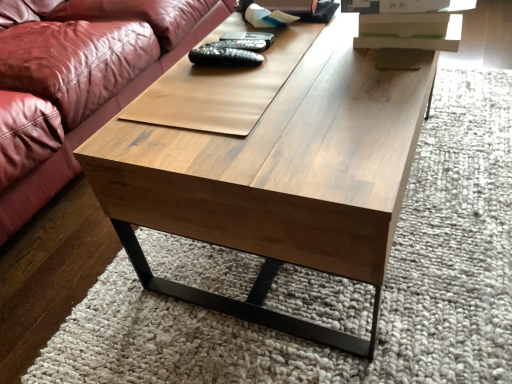
What do you see at coordinates (240, 44) in the screenshot? I see `black matte remote at center, positioned as the second remote in bottom-to-top order` at bounding box center [240, 44].

Identify the location of black matte remote at center, the 3th remote when ordered from top to bottom. (224, 56).

What is the approximate height of wooden coffee table at center?

The height of wooden coffee table at center is 44.44 centimeters.

Find the location of a particular element. This screenshot has width=512, height=384. black matte remote at center, which ranks as the second remote in top-to-bottom order is located at coordinates coord(240,44).

Based on the photo, how different are the orientations of wooden coffee table at center and black matte remote at center, which ranks as the second remote in top-to-bottom order, in degrees?

The facing directions of wooden coffee table at center and black matte remote at center, which ranks as the second remote in top-to-bottom order, are 4.7 degrees apart.

Who is shorter, wooden coffee table at center or black matte remote at center, which ranks as the second remote in top-to-bottom order?

Standing shorter between the two is black matte remote at center, which ranks as the second remote in top-to-bottom order.

Based on their sizes in the image, would you say wooden coffee table at center is bigger or smaller than black matte remote at center, positioned as the second remote in bottom-to-top order?

Clearly, wooden coffee table at center is larger in size than black matte remote at center, positioned as the second remote in bottom-to-top order.

Is black matte remote at center, positioned as the second remote in bottom-to-top order, aimed at wooden coffee table at center?

No, black matte remote at center, positioned as the second remote in bottom-to-top order, is not turned towards wooden coffee table at center.

Is black matte remote at center, positioned as the second remote in bottom-to-top order, thinner than wooden coffee table at center?

Correct, the width of black matte remote at center, positioned as the second remote in bottom-to-top order, is less than that of wooden coffee table at center.

From the image's perspective, is black matte remote at center, which ranks as the second remote in top-to-bottom order, located above wooden coffee table at center?

Indeed, from the image's perspective, black matte remote at center, which ranks as the second remote in top-to-bottom order, is shown above wooden coffee table at center.

How distant is black matte remote at center, positioned as the second remote in bottom-to-top order, from wooden coffee table at center?

A distance of 16.55 inches exists between black matte remote at center, positioned as the second remote in bottom-to-top order, and wooden coffee table at center.

Which point is more forward, (250, 47) or (259, 38)?

Point (250, 47)

From a real-world perspective, who is located higher, black matte remote at center, positioned as the second remote in bottom-to-top order, or black plastic remote at center, the 3th remote ordered from the bottom?

From a 3D spatial view, black plastic remote at center, the 3th remote ordered from the bottom, is above.

Which object is positioned more to the left, black matte remote at center, which ranks as the second remote in top-to-bottom order, or black plastic remote at center, which ranks as the first remote in top-to-bottom order?

black matte remote at center, which ranks as the second remote in top-to-bottom order.

Which object is thinner, wooden coffee table at center or black plastic remote at center, which ranks as the first remote in top-to-bottom order?

black plastic remote at center, which ranks as the first remote in top-to-bottom order, is thinner.

Considering the sizes of wooden coffee table at center and black plastic remote at center, the 3th remote ordered from the bottom, in the image, is wooden coffee table at center bigger or smaller than black plastic remote at center, the 3th remote ordered from the bottom,?

In the image, wooden coffee table at center appears to be larger than black plastic remote at center, the 3th remote ordered from the bottom.

In the scene shown: Would you say wooden coffee table at center is outside black plastic remote at center, which ranks as the first remote in top-to-bottom order?

Absolutely, wooden coffee table at center is external to black plastic remote at center, which ranks as the first remote in top-to-bottom order.

Can you confirm if black plastic remote at center, the 3th remote ordered from the bottom, is smaller than black matte remote at center, the 3th remote when ordered from top to bottom?

Indeed, black plastic remote at center, the 3th remote ordered from the bottom, has a smaller size compared to black matte remote at center, the 3th remote when ordered from top to bottom.

From the image's perspective, is black plastic remote at center, the 3th remote ordered from the bottom, above or below black matte remote at center, positioned as the first remote in bottom-to-top order?

Clearly, from the image's perspective, black plastic remote at center, the 3th remote ordered from the bottom, is above black matte remote at center, positioned as the first remote in bottom-to-top order.

From a real-world perspective, is black plastic remote at center, which ranks as the first remote in top-to-bottom order, on top of black matte remote at center, the 3th remote when ordered from top to bottom?

No, from a real-world perspective, black plastic remote at center, which ranks as the first remote in top-to-bottom order, is not above black matte remote at center, the 3th remote when ordered from top to bottom.

Looking at their sizes, would you say black plastic remote at center, the 3th remote ordered from the bottom, is wider or thinner than black matte remote at center, positioned as the first remote in bottom-to-top order?

black plastic remote at center, the 3th remote ordered from the bottom, is thinner than black matte remote at center, positioned as the first remote in bottom-to-top order.

Is black plastic remote at center, the 3th remote ordered from the bottom, positioned with its back to wooden coffee table at center?

No.

Would you consider black plastic remote at center, which ranks as the first remote in top-to-bottom order, to be distant from wooden coffee table at center?

No, black plastic remote at center, which ranks as the first remote in top-to-bottom order, is in close proximity to wooden coffee table at center.

Between black plastic remote at center, the 3th remote ordered from the bottom, and wooden coffee table at center, which one appears on the left side from the viewer's perspective?

Positioned to the left is black plastic remote at center, the 3th remote ordered from the bottom.

Is black plastic remote at center, which ranks as the first remote in top-to-bottom order, wider than wooden coffee table at center?

No.

Between black plastic remote at center, which ranks as the first remote in top-to-bottom order, and black matte remote at center, which ranks as the second remote in top-to-bottom order, which one appears on the right side from the viewer's perspective?

Positioned to the right is black plastic remote at center, which ranks as the first remote in top-to-bottom order.

What's the angular difference between black plastic remote at center, which ranks as the first remote in top-to-bottom order, and black matte remote at center, positioned as the second remote in bottom-to-top order,'s facing directions?

0.00109 degrees separate the facing orientations of black plastic remote at center, which ranks as the first remote in top-to-bottom order, and black matte remote at center, positioned as the second remote in bottom-to-top order.

Which object is further away from the camera taking this photo, black plastic remote at center, which ranks as the first remote in top-to-bottom order, or black matte remote at center, which ranks as the second remote in top-to-bottom order?

black plastic remote at center, which ranks as the first remote in top-to-bottom order, is more distant.

Considering the sizes of objects black plastic remote at center, the 3th remote ordered from the bottom, and black matte remote at center, which ranks as the second remote in top-to-bottom order, in the image provided, who is taller, black plastic remote at center, the 3th remote ordered from the bottom, or black matte remote at center, which ranks as the second remote in top-to-bottom order,?

With more height is black plastic remote at center, the 3th remote ordered from the bottom.

In the image, there is a black matte remote at center, which ranks as the second remote in top-to-bottom order. Identify the location of coffee table below it (from a real-world perspective). This screenshot has width=512, height=384. (279, 177).

Locate an element on the screen. The width and height of the screenshot is (512, 384). coffee table in front of the black matte remote at center, which ranks as the second remote in top-to-bottom order is located at coordinates (x=279, y=177).

From the image, which object appears to be nearer to wooden coffee table at center, black matte remote at center, which ranks as the second remote in top-to-bottom order, or black plastic remote at center, which ranks as the first remote in top-to-bottom order?

The object closer to wooden coffee table at center is black matte remote at center, which ranks as the second remote in top-to-bottom order.

Looking at the image, which one is located further to black plastic remote at center, which ranks as the first remote in top-to-bottom order, black matte remote at center, positioned as the second remote in bottom-to-top order, or black matte remote at center, positioned as the first remote in bottom-to-top order?

black matte remote at center, positioned as the first remote in bottom-to-top order.

Consider the image. Based on their spatial positions, is black plastic remote at center, which ranks as the first remote in top-to-bottom order, or black matte remote at center, which ranks as the second remote in top-to-bottom order, closer to wooden coffee table at center?

black matte remote at center, which ranks as the second remote in top-to-bottom order, lies closer to wooden coffee table at center than the other object.

Looking at this image, which object lies further to the anchor point wooden coffee table at center, black matte remote at center, the 3th remote when ordered from top to bottom, or black plastic remote at center, which ranks as the first remote in top-to-bottom order?

black plastic remote at center, which ranks as the first remote in top-to-bottom order, lies further to wooden coffee table at center than the other object.

From the image, which object appears to be farther from black plastic remote at center, the 3th remote ordered from the bottom, wooden coffee table at center or black matte remote at center, positioned as the first remote in bottom-to-top order?

wooden coffee table at center is further to black plastic remote at center, the 3th remote ordered from the bottom.

Looking at the image, which one is located further to black matte remote at center, the 3th remote when ordered from top to bottom, wooden coffee table at center or black matte remote at center, positioned as the second remote in bottom-to-top order?

wooden coffee table at center.

When comparing their distances from black plastic remote at center, which ranks as the first remote in top-to-bottom order, does black matte remote at center, the 3th remote when ordered from top to bottom, or wooden coffee table at center seem closer?

The object closer to black plastic remote at center, which ranks as the first remote in top-to-bottom order, is black matte remote at center, the 3th remote when ordered from top to bottom.

When comparing their distances from wooden coffee table at center, does black matte remote at center, positioned as the first remote in bottom-to-top order, or black matte remote at center, positioned as the second remote in bottom-to-top order, seem further?

Among the two, black matte remote at center, positioned as the second remote in bottom-to-top order, is located further to wooden coffee table at center.

At what (x,y) coordinates should I click in order to perform the action: click on remote between wooden coffee table at center and black matte remote at center, positioned as the second remote in bottom-to-top order, along the z-axis. Please return your answer as a coordinate pair (x, y). Looking at the image, I should click on (224, 56).

Image resolution: width=512 pixels, height=384 pixels. In order to click on remote located between black matte remote at center, the 3th remote when ordered from top to bottom, and black plastic remote at center, the 3th remote ordered from the bottom, in the depth direction in this screenshot , I will do tap(240, 44).